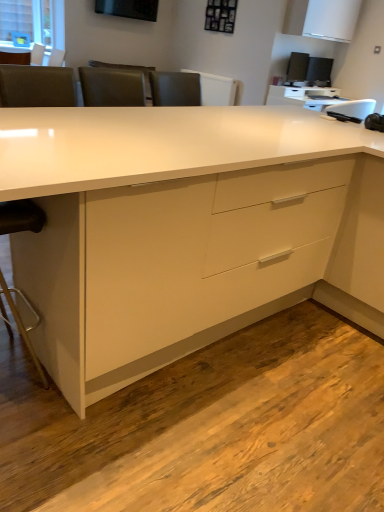
Question: From the image's perspective, is white glossy cabinet at upper right under white glossy computer desk at upper right?

Choices:
 (A) no
 (B) yes

Answer: (A)

Question: Considering the relative sizes of white glossy cabinet at upper right and white glossy computer desk at upper right in the image provided, is white glossy cabinet at upper right thinner than white glossy computer desk at upper right?

Choices:
 (A) no
 (B) yes

Answer: (B)

Question: Is white glossy cabinet at upper right not within white glossy computer desk at upper right?

Choices:
 (A) yes
 (B) no

Answer: (A)

Question: Is white glossy cabinet at upper right wider than white glossy computer desk at upper right?

Choices:
 (A) no
 (B) yes

Answer: (A)

Question: Does white glossy cabinet at upper right have a greater height compared to white glossy computer desk at upper right?

Choices:
 (A) yes
 (B) no

Answer: (A)

Question: Is white glossy cabinet at upper right aimed at white glossy computer desk at upper right?

Choices:
 (A) no
 (B) yes

Answer: (A)

Question: Is black leather swivel chair at left not close to white glossy computer desk at upper right?

Choices:
 (A) no
 (B) yes

Answer: (B)

Question: Does black leather swivel chair at left turn towards white glossy computer desk at upper right?

Choices:
 (A) no
 (B) yes

Answer: (A)

Question: Considering the relative sizes of black leather swivel chair at left and white glossy computer desk at upper right in the image provided, is black leather swivel chair at left smaller than white glossy computer desk at upper right?

Choices:
 (A) yes
 (B) no

Answer: (A)

Question: Does black leather swivel chair at left have a lesser height compared to white glossy computer desk at upper right?

Choices:
 (A) no
 (B) yes

Answer: (A)

Question: From the image's perspective, is black leather swivel chair at left over white glossy computer desk at upper right?

Choices:
 (A) yes
 (B) no

Answer: (B)

Question: Is black leather swivel chair at left thinner than white glossy computer desk at upper right?

Choices:
 (A) no
 (B) yes

Answer: (B)

Question: Is white glossy cabinet at upper right oriented away from black plastic desktop computer at upper right?

Choices:
 (A) no
 (B) yes

Answer: (A)